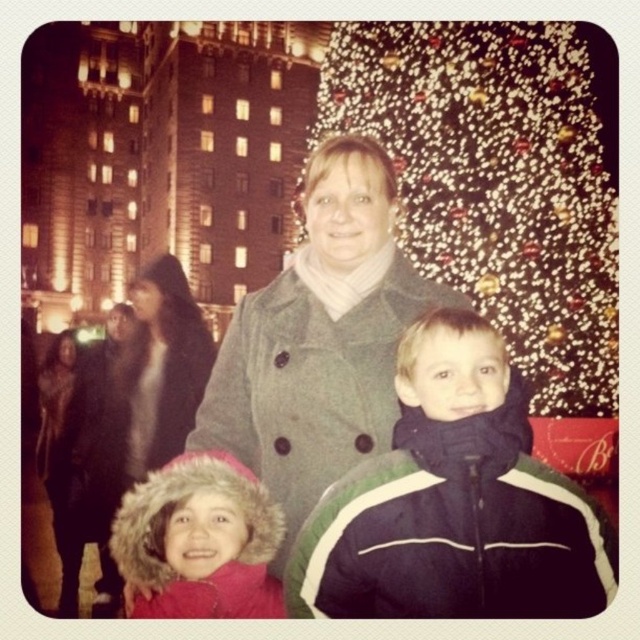
You are a photographer at the event and need to decide where to place a large tripod without blocking anyone. The gray wool coat at center and the fuzzy black coat at center are in the way. Which coat should you move to make space?

The gray wool coat at center is larger in size than the fuzzy black coat at center, so you should move the gray wool coat at center to make space for the tripod.

You are a photographer setting up a tripod in front of the Christmas tree. You need to position the tripod so that both the fuzzy black coat at center and the black fur coat at left are visible in the frame. Which coat should you place closer to the edge of the frame to ensure both are fully visible?

Since the fuzzy black coat at center might be wider than the black fur coat at left, you should place the fuzzy black coat at center closer to the edge of the frame to ensure both are fully visible.